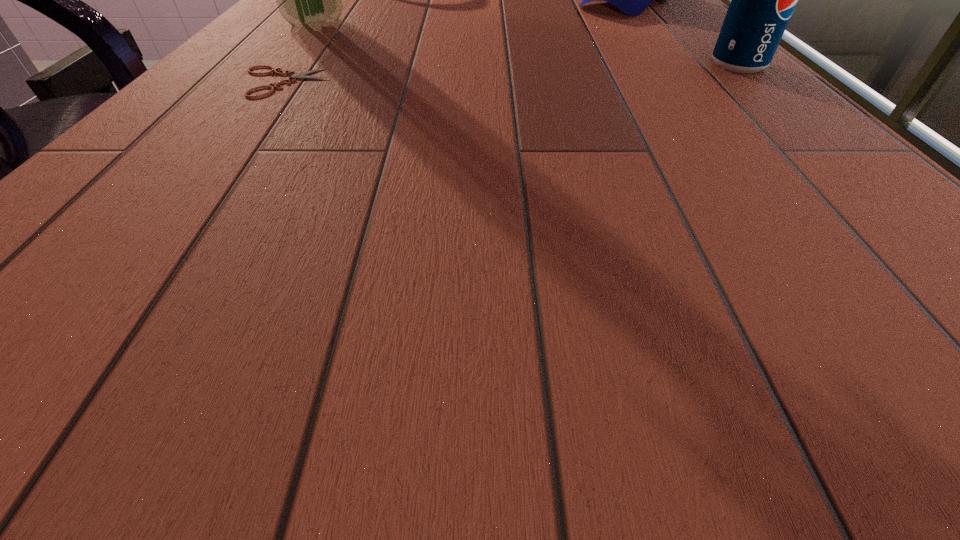
The width and height of the screenshot is (960, 540). I want to click on object that stands as the third closest to the shortest object, so click(762, 0).

Identify the location of vacant space that satisfies the following two spatial constraints: 1. on the front side of the tallest object; 2. on the left side of the second tallest object. (280, 64).

Locate an element on the screen. Image resolution: width=960 pixels, height=540 pixels. vacant space that satisfies the following two spatial constraints: 1. on the front side of the tallest object; 2. on the left side of the second tallest object is located at coordinates (280, 64).